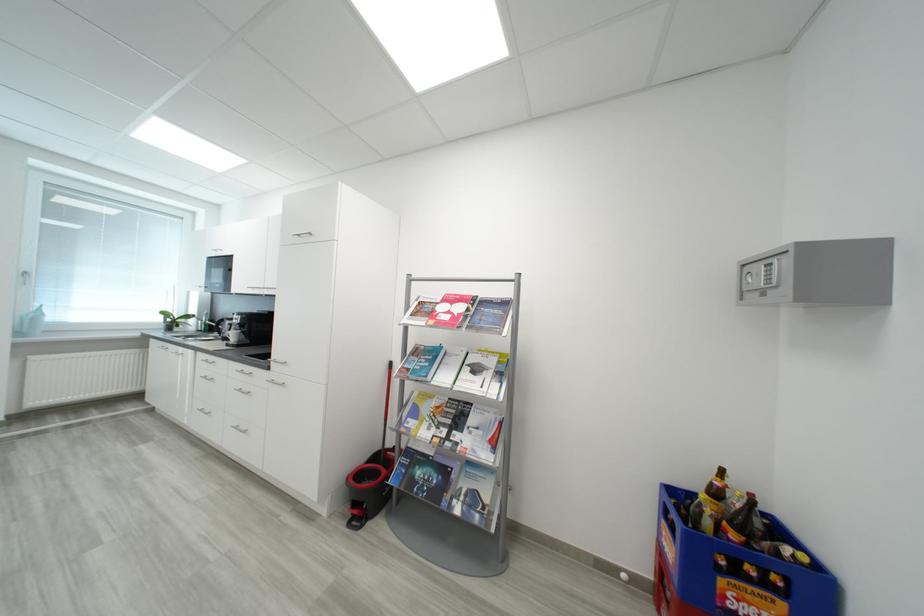
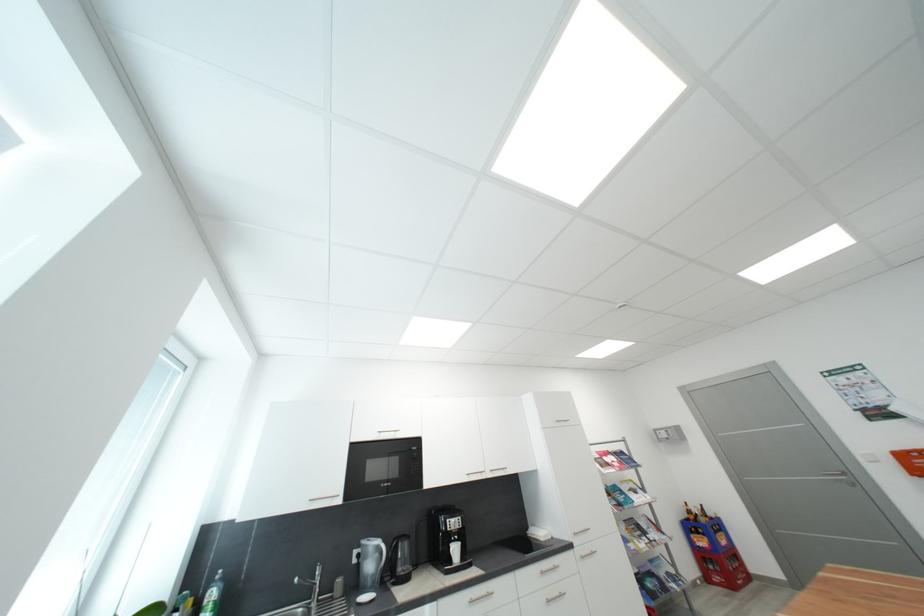
Find the pixel in the second image that matches point 240,336 in the first image.

(463, 552)